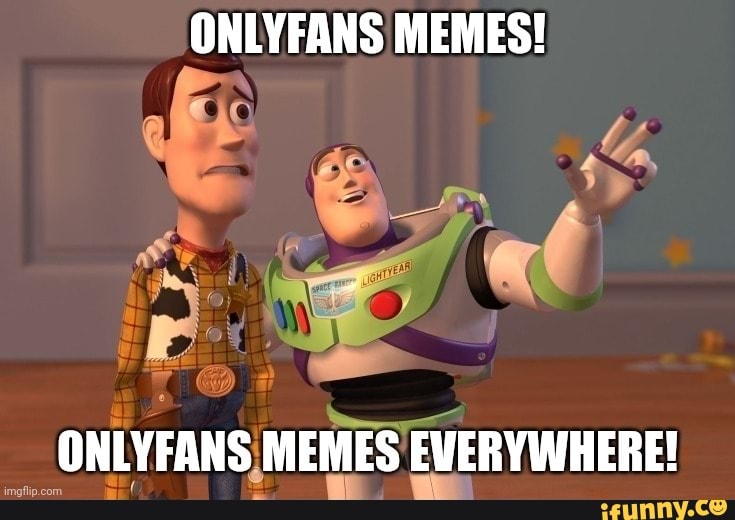
Where is `yellow  stars on the wall in the background on the right`? This screenshot has width=735, height=520. yellow  stars on the wall in the background on the right is located at coordinates (662, 253), (562, 145), (480, 119).